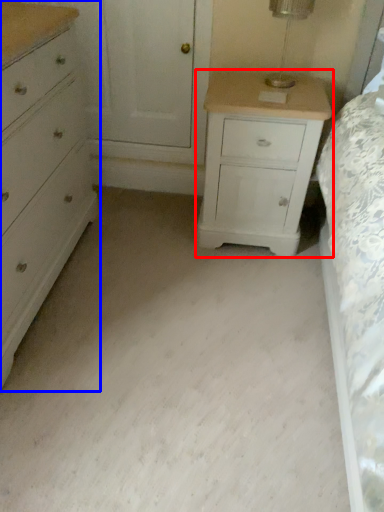
Question: Which point is closer to the camera, nightstand (highlighted by a red box) or chest of drawers (highlighted by a blue box)?

Choices:
 (A) nightstand
 (B) chest of drawers

Answer: (B)